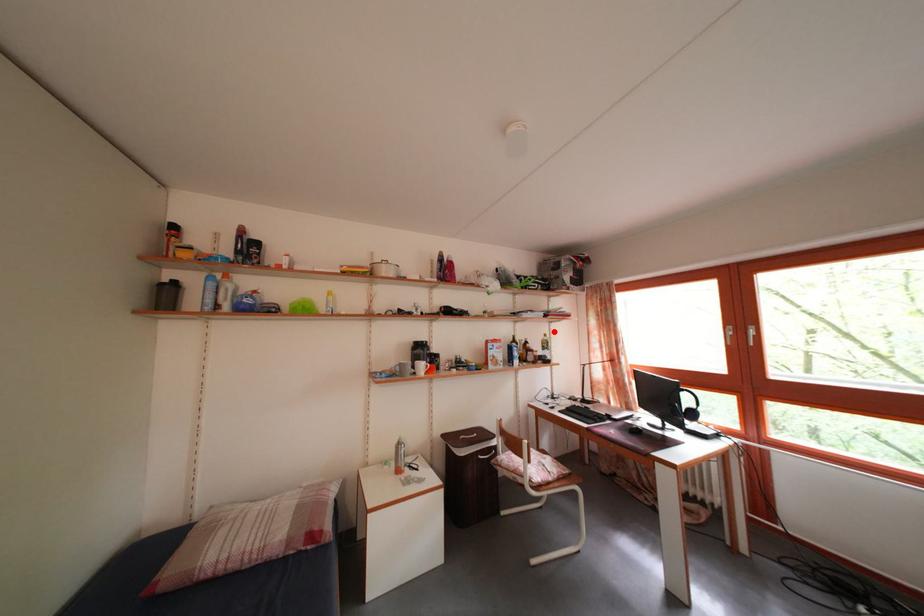
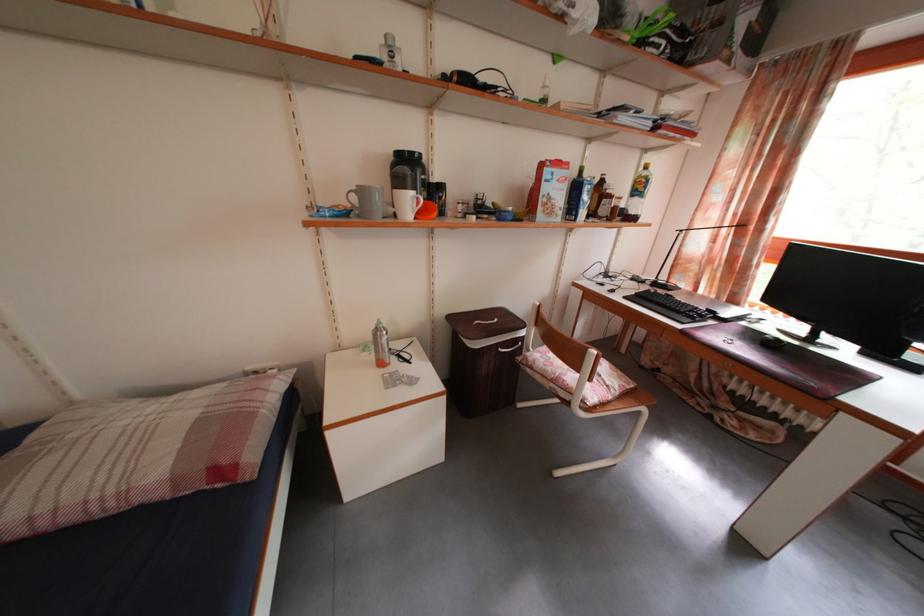
Question: I am providing you with two images of the same scene from different viewpoints. Given a red point in image1, look at the same physical point in image2. Is it:

Choices:
 (A) Closer to the viewpoint
 (B) Farther from the viewpoint

Answer: (A)